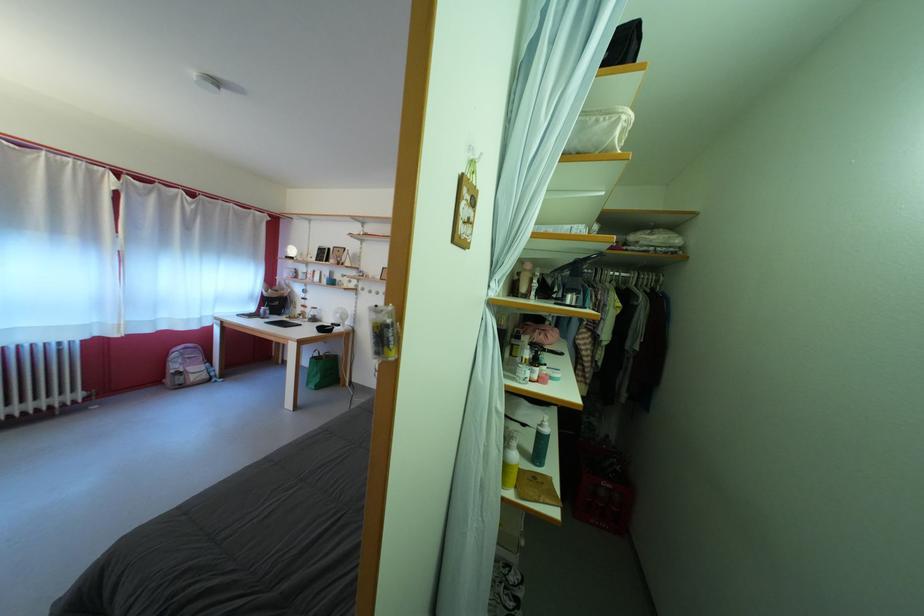
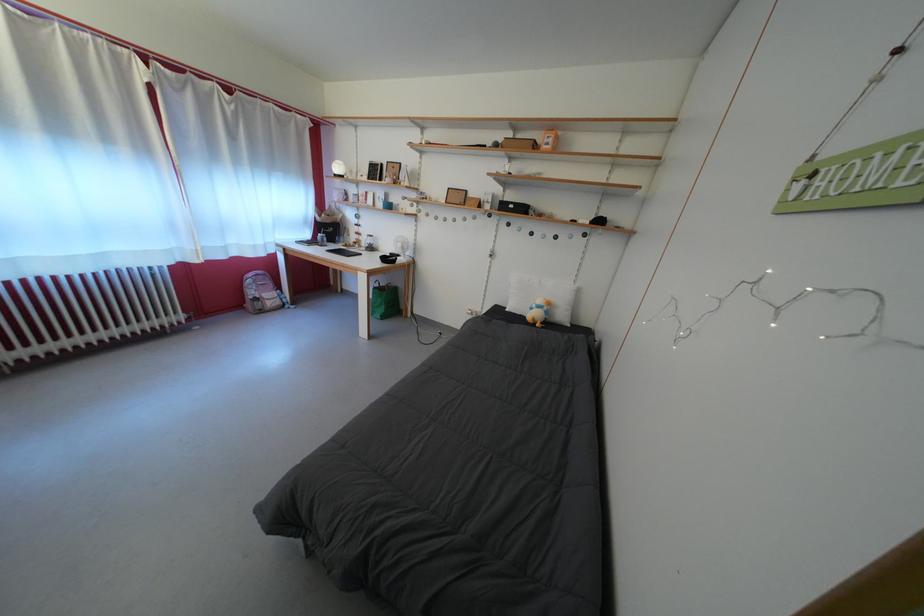
Question: Based on the continuous images, in which direction is the camera rotating? Reply with the corresponding letter.

Choices:
 (A) Left
 (B) Right
 (C) Up
 (D) Down

Answer: (D)